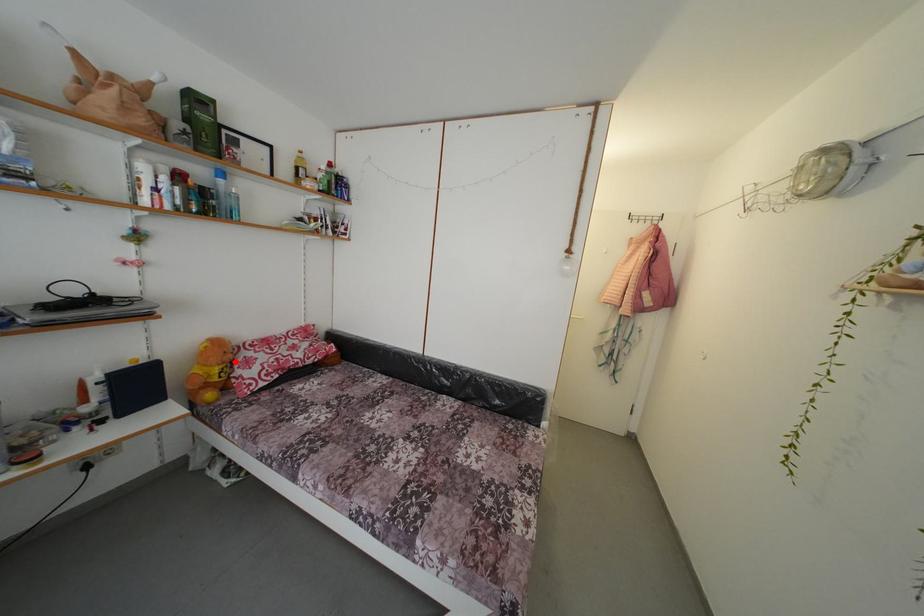
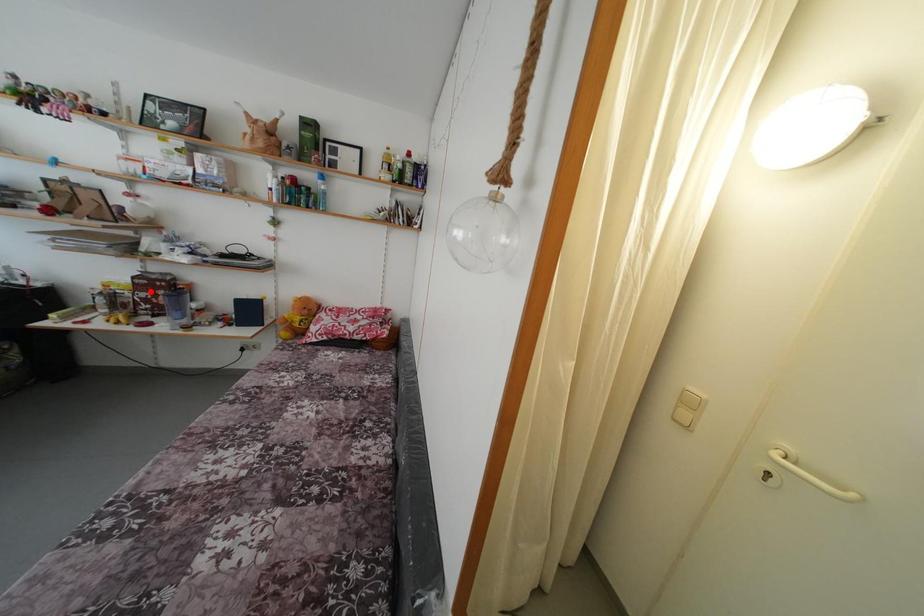
I am providing you with two images of the same scene from different viewpoints. A red point is marked on the first image and another point is marked on the second image. Does the point marked in image1 correspond to the same location as the one in image2?

No